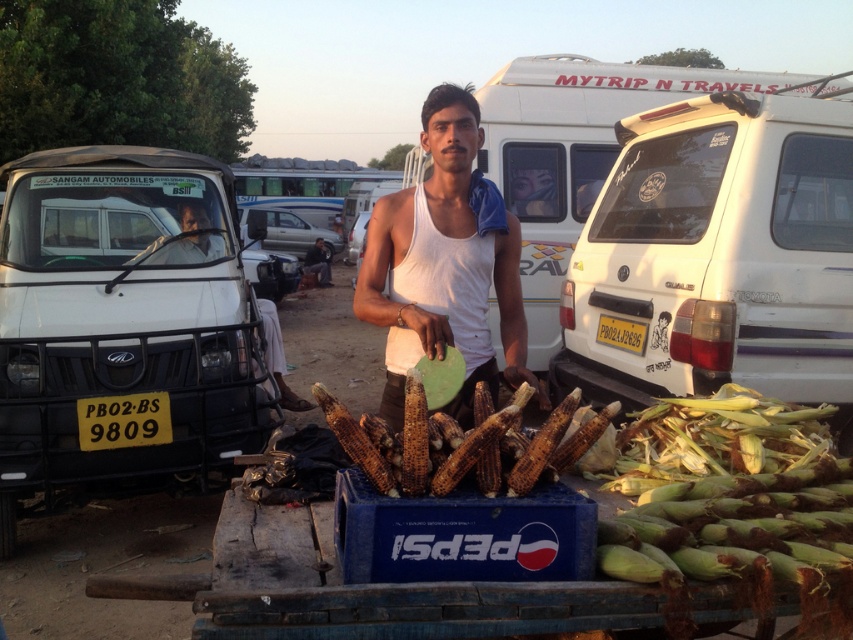
Who is lower down, yellowmaterial/texturelicense plate at lower left or dark blue jeans at center?

yellowmaterial/texturelicense plate at lower left is below.

Can you confirm if yellowmaterial/texturelicense plate at lower left is positioned below dark blue jeans at center?

Yes, yellowmaterial/texturelicense plate at lower left is below dark blue jeans at center.

Image resolution: width=853 pixels, height=640 pixels. What do you see at coordinates (123, 420) in the screenshot?
I see `yellowmaterial/texturelicense plate at lower left` at bounding box center [123, 420].

Find the location of a particular element. Image resolution: width=853 pixels, height=640 pixels. yellowmaterial/texturelicense plate at lower left is located at coordinates (123, 420).

Can you confirm if white matte van at right is taller than white cotton tank top at center?

Yes, white matte van at right is taller than white cotton tank top at center.

Is point (845, 243) more distant than point (378, 224)?

Yes.

Locate an element on the screen. The width and height of the screenshot is (853, 640). white matte van at right is located at coordinates (718, 253).

What do you see at coordinates (718, 253) in the screenshot? The image size is (853, 640). I see `white matte van at right` at bounding box center [718, 253].

Can you confirm if white matte van at right is thinner than dark blue jeans at center?

In fact, white matte van at right might be wider than dark blue jeans at center.

Locate an element on the screen. This screenshot has width=853, height=640. white matte van at right is located at coordinates (718, 253).

Identify the location of white matte van at right. (718, 253).